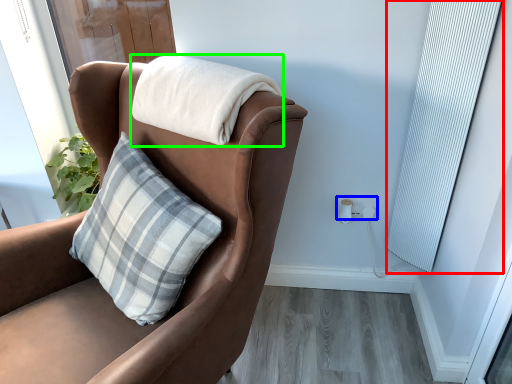
Question: Which object is the closest to the curtain (highlighted by a red box)? Choose among these: electric outlet (highlighted by a blue box) or blanket (highlighted by a green box).

Choices:
 (A) electric outlet
 (B) blanket

Answer: (A)